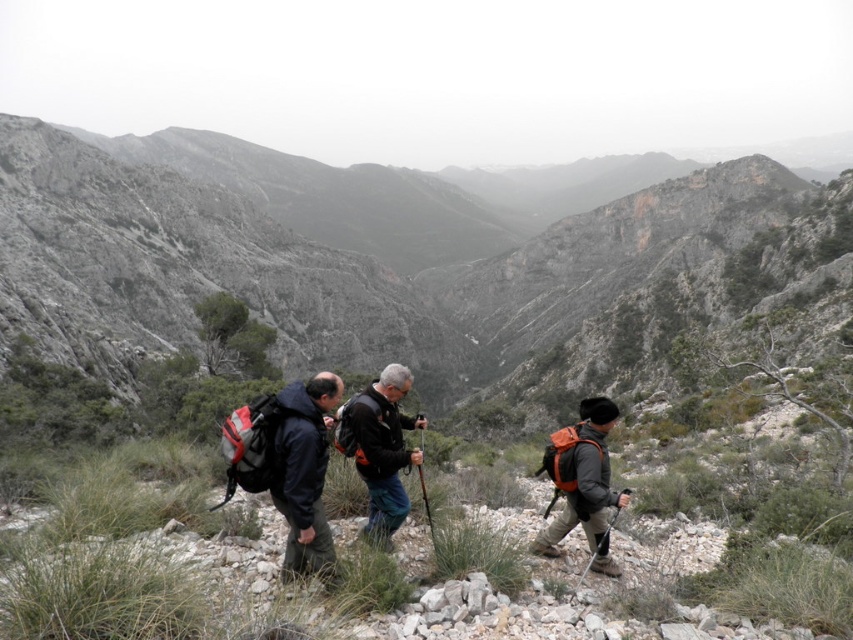
You are a hiker trying to locate your friend wearing a dark blue jacket at center. Based on the coordinates provided, can you determine if your friend is positioned closer to the top or bottom of the image?

The dark blue jacket at center is located at coordinates point (373, 442). Since the y coordinate is 0.438, which is closer to the bottom of the image, your friend is positioned closer to the bottom of the image.

Consider the image. You are one of the hikers wearing the dark blue jacket at center. You want to take a photo of the rugged stone mountain at center. Which direction should you face to capture the mountain in your photo?

Since the rugged stone mountain at center is bigger than the dark blue jacket at center, you should face towards the rugged stone mountain at center to capture it in your photo.

You are one of the hikers trying to take a photo of the rugged stone mountain at center. You have your camera in your left hand and your orange fabric backpack at right is on your back. To get a clear shot, you need to ensure the backpack isn not blocking the mountain. Is the mountain wider than the backpack?

The rugged stone mountain at center is wider than the orange fabric backpack at right, so the mountain will not be fully blocked by the backpack when taking the photo.